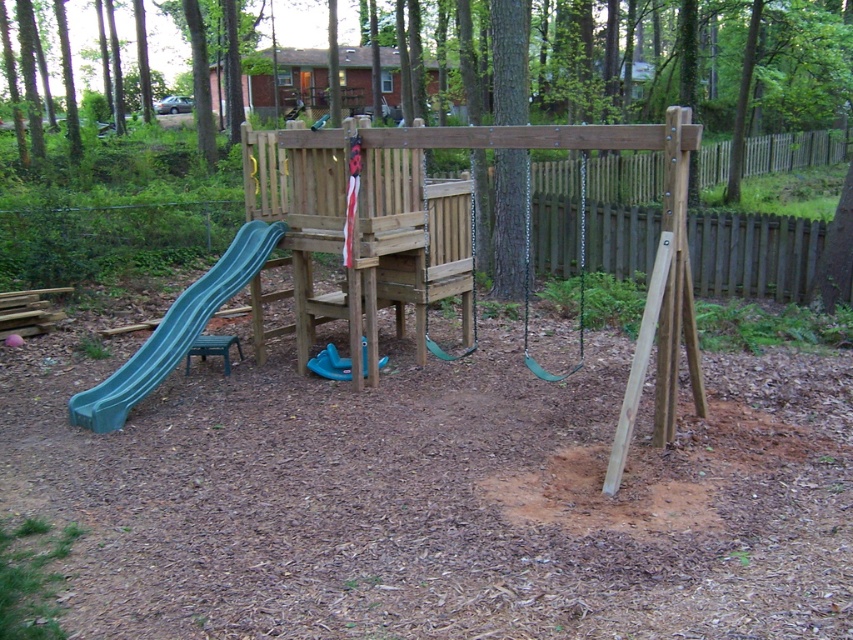
Question: Which object appears farthest from the camera in this image?

Choices:
 (A) wooden swing at center
 (B) blue rubber slide at center
 (C) teal plastic slide at left

Answer: (A)

Question: Which point is closer to the camera?

Choices:
 (A) (425, 237)
 (B) (151, 388)

Answer: (B)

Question: Estimate the real-world distances between objects in this image. Which object is closer to the wooden swing at center?

Choices:
 (A) teal plastic slide at left
 (B) green rubber swing at center

Answer: (B)

Question: Can you confirm if wooden swing at center is positioned to the right of blue rubber slide at center?

Choices:
 (A) no
 (B) yes

Answer: (B)

Question: Is teal plastic slide at left smaller than wooden swing at center?

Choices:
 (A) no
 (B) yes

Answer: (A)

Question: Does teal plastic slide at left appear on the right side of blue rubber slide at center?

Choices:
 (A) yes
 (B) no

Answer: (B)